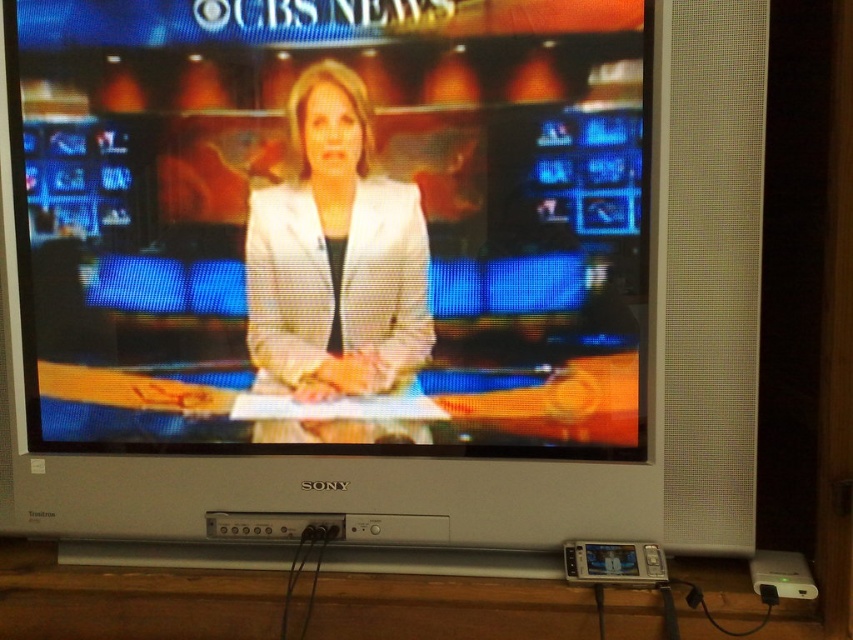
Looking at this image, you are trying to decide which item to place on the wooden surface in front of the TV. The options are the matte white suit at center and the white matte blazer at center. Which one requires more space due to its size?

The matte white suit at center requires more space because it is larger in size than the white matte blazer at center.

You are a fashion designer observing the CBS News broadcast scene. You notice two items of clothing at the center of the screen. Which one is taller between the matte white suit at center and the white matte blazer at center?

The matte white suit at center is taller than the white matte blazer at center.

You are a person standing in front of the TV. You see the matte white suit at center and the white matte blazer at center. Which one is closer to you?

The matte white suit at center is closer to you since it is in front of the white matte blazer at center.